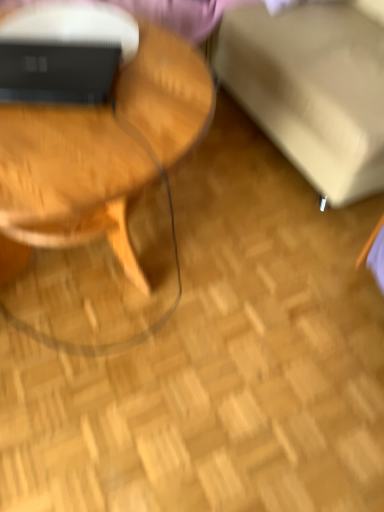
At what (x,y) coordinates should I click in order to perform the action: click on beige fabric swivel chair at upper right. Please return your answer as a coordinate pair (x, y). This screenshot has width=384, height=512. Looking at the image, I should click on pyautogui.click(x=312, y=89).

Where is `woodenmaterial/texturecoffee table at left`? woodenmaterial/texturecoffee table at left is located at coordinates (67, 182).

Between woodenmaterial/texturecoffee table at left and matte black laptop at upper left, which one has less height?

With less height is matte black laptop at upper left.

Could you tell me if woodenmaterial/texturecoffee table at left is turned towards matte black laptop at upper left?

No, woodenmaterial/texturecoffee table at left is not aimed at matte black laptop at upper left.

Is matte black laptop at upper left located within woodenmaterial/texturecoffee table at left?

Indeed, matte black laptop at upper left is located within woodenmaterial/texturecoffee table at left.

From the image's perspective, who appears lower, beige fabric swivel chair at upper right or woodenmaterial/texturecoffee table at left?

woodenmaterial/texturecoffee table at left.

Is point (234, 52) farther from viewer compared to point (133, 125)?

Yes.

Considering the relative positions of beige fabric swivel chair at upper right and woodenmaterial/texturecoffee table at left in the image provided, is beige fabric swivel chair at upper right to the right of woodenmaterial/texturecoffee table at left from the viewer's perspective?

Yes, beige fabric swivel chair at upper right is to the right of woodenmaterial/texturecoffee table at left.

Considering the relative positions of beige fabric swivel chair at upper right and woodenmaterial/texturecoffee table at left in the image provided, is beige fabric swivel chair at upper right in front of woodenmaterial/texturecoffee table at left?

No, beige fabric swivel chair at upper right is further to the viewer.

From a real-world perspective, which is physically above, beige fabric swivel chair at upper right or matte black laptop at upper left?

In real-world perspective, matte black laptop at upper left is above.

From the image's perspective, between beige fabric swivel chair at upper right and matte black laptop at upper left, which one is located above?

beige fabric swivel chair at upper right, from the image's perspective.

Can you confirm if beige fabric swivel chair at upper right is bigger than matte black laptop at upper left?

Yes.

Considering the points (231, 20) and (96, 59), which point is in front, point (231, 20) or point (96, 59)?

Point (96, 59)

You are a GUI agent. You are given a task and a screenshot of the screen. Output one action in this format:
    pyautogui.click(x=<x>, y=<y>)
    Task: Click on the coffee table below the beige fabric swivel chair at upper right (from the image's perspective)
    
    Given the screenshot: What is the action you would take?
    pyautogui.click(x=67, y=182)

Which object is closer to the camera, woodenmaterial/texturecoffee table at left or beige fabric swivel chair at upper right?

Positioned in front is woodenmaterial/texturecoffee table at left.

Which is more to the left, woodenmaterial/texturecoffee table at left or beige fabric swivel chair at upper right?

woodenmaterial/texturecoffee table at left is more to the left.

How many degrees apart are the facing directions of matte black laptop at upper left and woodenmaterial/texturecoffee table at left?

They differ by 28.5 degrees in their facing directions.

Is matte black laptop at upper left wider than woodenmaterial/texturecoffee table at left?

Incorrect, the width of matte black laptop at upper left does not surpass that of woodenmaterial/texturecoffee table at left.

Does matte black laptop at upper left have a lesser height compared to woodenmaterial/texturecoffee table at left?

Yes.

Is there a large distance between matte black laptop at upper left and woodenmaterial/texturecoffee table at left?

That's not correct — matte black laptop at upper left is a little close to woodenmaterial/texturecoffee table at left.

Consider the image. Considering the positions of objects matte black laptop at upper left and beige fabric swivel chair at upper right in the image provided, who is more to the left, matte black laptop at upper left or beige fabric swivel chair at upper right?

matte black laptop at upper left.

Who is bigger, matte black laptop at upper left or beige fabric swivel chair at upper right?

beige fabric swivel chair at upper right is bigger.

From a real-world perspective, does matte black laptop at upper left stand above beige fabric swivel chair at upper right?

Indeed, from a real-world perspective, matte black laptop at upper left stands above beige fabric swivel chair at upper right.

How different are the orientations of matte black laptop at upper left and beige fabric swivel chair at upper right in degrees?

26.8 degrees.

You are a GUI agent. You are given a task and a screenshot of the screen. Output one action in this format:
    pyautogui.click(x=<x>, y=<y>)
    Task: Click on the coffee table on the right of the matte black laptop at upper left
    
    Given the screenshot: What is the action you would take?
    pyautogui.click(x=67, y=182)

In order to click on swivel chair lying behind the woodenmaterial/texturecoffee table at left in this screenshot , I will do `click(312, 89)`.

Which object lies further to the anchor point beige fabric swivel chair at upper right, matte black laptop at upper left or woodenmaterial/texturecoffee table at left?

matte black laptop at upper left is positioned further to the anchor beige fabric swivel chair at upper right.

From the image, which object appears to be farther from matte black laptop at upper left, woodenmaterial/texturecoffee table at left or beige fabric swivel chair at upper right?

beige fabric swivel chair at upper right is further to matte black laptop at upper left.

When comparing their distances from beige fabric swivel chair at upper right, does woodenmaterial/texturecoffee table at left or matte black laptop at upper left seem further?

matte black laptop at upper left is positioned further to the anchor beige fabric swivel chair at upper right.

Which object lies nearer to the anchor point woodenmaterial/texturecoffee table at left, beige fabric swivel chair at upper right or matte black laptop at upper left?

matte black laptop at upper left is closer to woodenmaterial/texturecoffee table at left.

When comparing their distances from woodenmaterial/texturecoffee table at left, does matte black laptop at upper left or beige fabric swivel chair at upper right seem further?

beige fabric swivel chair at upper right lies further to woodenmaterial/texturecoffee table at left than the other object.

When comparing their distances from matte black laptop at upper left, does beige fabric swivel chair at upper right or woodenmaterial/texturecoffee table at left seem closer?

Based on the image, woodenmaterial/texturecoffee table at left appears to be nearer to matte black laptop at upper left.

At what (x,y) coordinates should I click in order to perform the action: click on coffee table located between matte black laptop at upper left and beige fabric swivel chair at upper right in the left-right direction. Please return your answer as a coordinate pair (x, y). The width and height of the screenshot is (384, 512). Looking at the image, I should click on (67, 182).